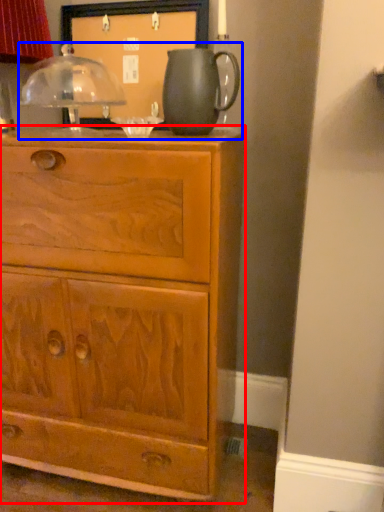
Question: Which point is closer to the camera, chest of drawers (highlighted by a red box) or tea set (highlighted by a blue box)?

Choices:
 (A) chest of drawers
 (B) tea set

Answer: (A)